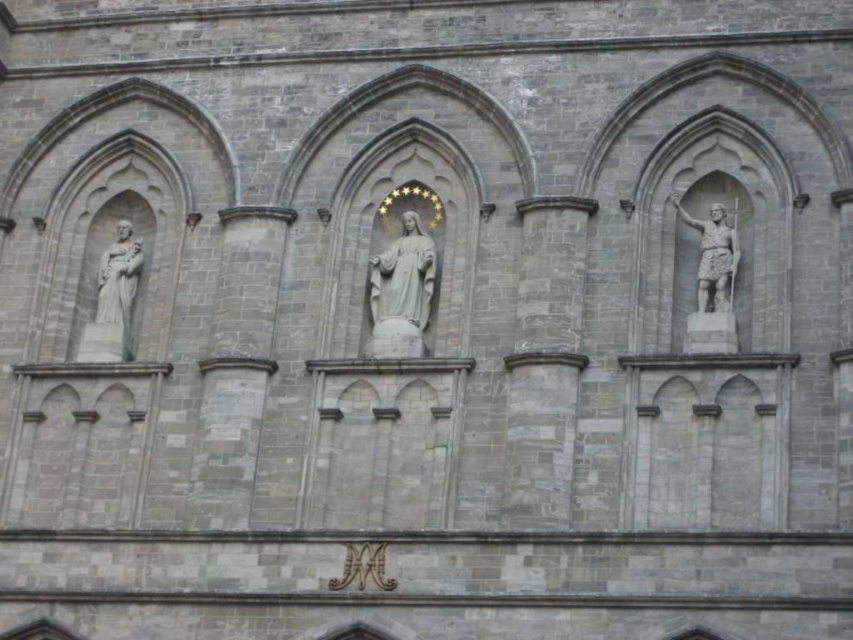
At what (x,y) coordinates should I click in order to perform the action: click on polished bronze statue at upper right. Please return your answer as a coordinate pair (x, y). The height and width of the screenshot is (640, 853). Looking at the image, I should click on (709, 276).

Which of these two, polished bronze statue at upper right or white marble statue at center, stands taller?

white marble statue at center is taller.

Does point (706, 182) come in front of point (387, 292)?

No, it is behind (387, 292).

You are a GUI agent. You are given a task and a screenshot of the screen. Output one action in this format:
    pyautogui.click(x=<x>, y=<y>)
    Task: Click on the polished bronze statue at upper right
    The width and height of the screenshot is (853, 640).
    Given the screenshot: What is the action you would take?
    pyautogui.click(x=709, y=276)

Which is in front, point (683, 208) or point (97, 268)?

Point (683, 208) is more forward.

Measure the distance between polished bronze statue at upper right and white marble statue at left.

A distance of 21.11 meters exists between polished bronze statue at upper right and white marble statue at left.

Locate an element on the screen. This screenshot has width=853, height=640. polished bronze statue at upper right is located at coordinates (709, 276).

Is white marble statue at center behind white marble statue at left?

No.

Is white marble statue at center taller than white marble statue at left?

Yes.

Which is behind, point (410, 282) or point (111, 253)?

The point (111, 253) is more distant.

Identify the location of white marble statue at center. (401, 292).